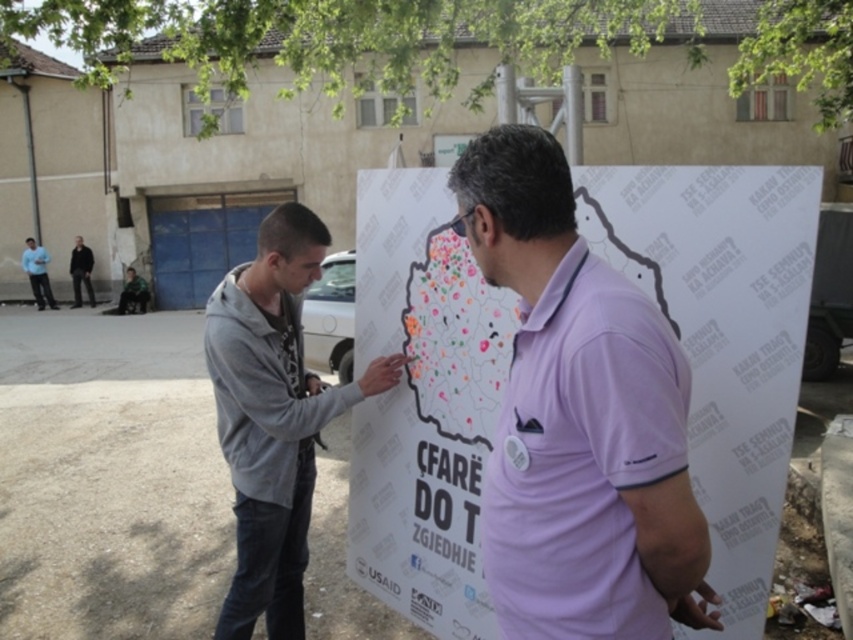
Which is more to the right, gray hoodie at left or dark gray jeans at left?

gray hoodie at left

Looking at this image, can you confirm if gray hoodie at left is positioned above dark gray jeans at left?

Actually, gray hoodie at left is below dark gray jeans at left.

Is point (276, 499) behind point (74, 298)?

No.

This screenshot has height=640, width=853. I want to click on gray hoodie at left, so click(273, 417).

Between gray hoodie at left and light blue shirt at left, which one has less height?

With less height is gray hoodie at left.

Locate an element on the screen. gray hoodie at left is located at coordinates (273, 417).

The width and height of the screenshot is (853, 640). Identify the location of gray hoodie at left. (273, 417).

Is point (229, 321) less distant than point (74, 272)?

Yes, it is.

Find the location of a particular element. This screenshot has width=853, height=640. gray fleece jacket at center is located at coordinates point(263,390).

What do you see at coordinates (263, 390) in the screenshot? This screenshot has height=640, width=853. I see `gray fleece jacket at center` at bounding box center [263, 390].

At what (x,y) coordinates should I click in order to perform the action: click on gray fleece jacket at center. Please return your answer as a coordinate pair (x, y). The image size is (853, 640). Looking at the image, I should click on (263, 390).